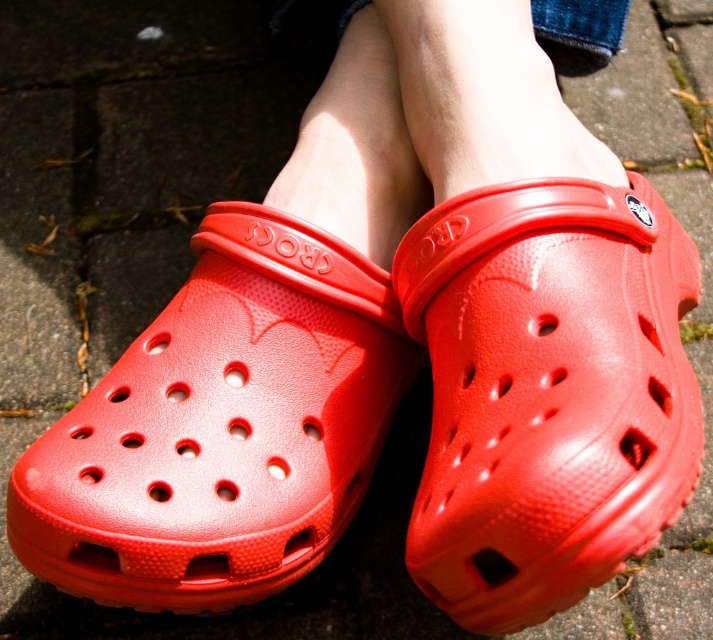
Question: Does satin red clog at center have a greater width compared to matte plastic clog at center?

Choices:
 (A) yes
 (B) no

Answer: (B)

Question: Which point is closer to the camera taking this photo?

Choices:
 (A) (461, 326)
 (B) (282, 586)

Answer: (A)

Question: Does satin red clog at center lie behind matte plastic clog at center?

Choices:
 (A) yes
 (B) no

Answer: (B)

Question: Considering the relative positions of satin red clog at center and matte plastic clog at center in the image provided, where is satin red clog at center located with respect to matte plastic clog at center?

Choices:
 (A) left
 (B) right

Answer: (B)

Question: Among these points, which one is nearest to the camera?

Choices:
 (A) (645, 227)
 (B) (240, 486)

Answer: (B)